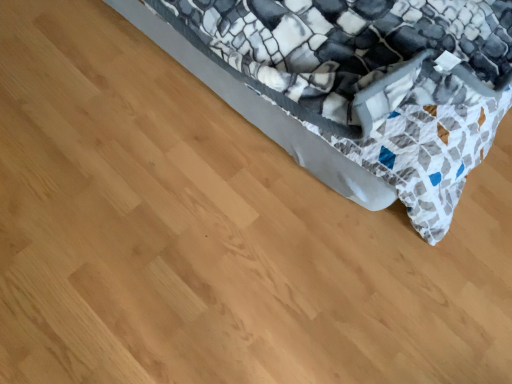
The height and width of the screenshot is (384, 512). Describe the element at coordinates (354, 86) in the screenshot. I see `patterned fabric couch at upper right` at that location.

Find the location of a particular element. The width and height of the screenshot is (512, 384). patterned fabric couch at upper right is located at coordinates (354, 86).

What are the coordinates of `patterned fabric couch at upper right` in the screenshot? It's located at point(354,86).